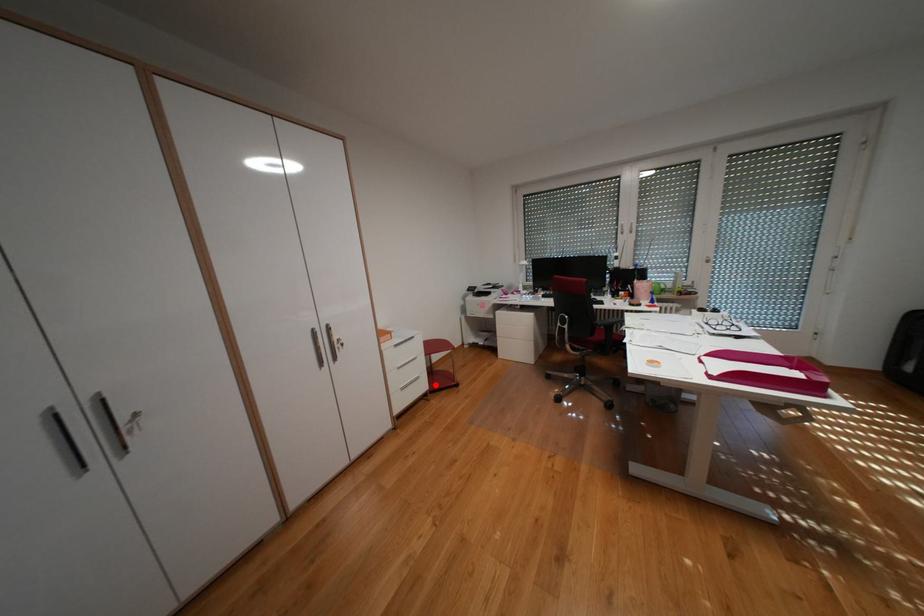
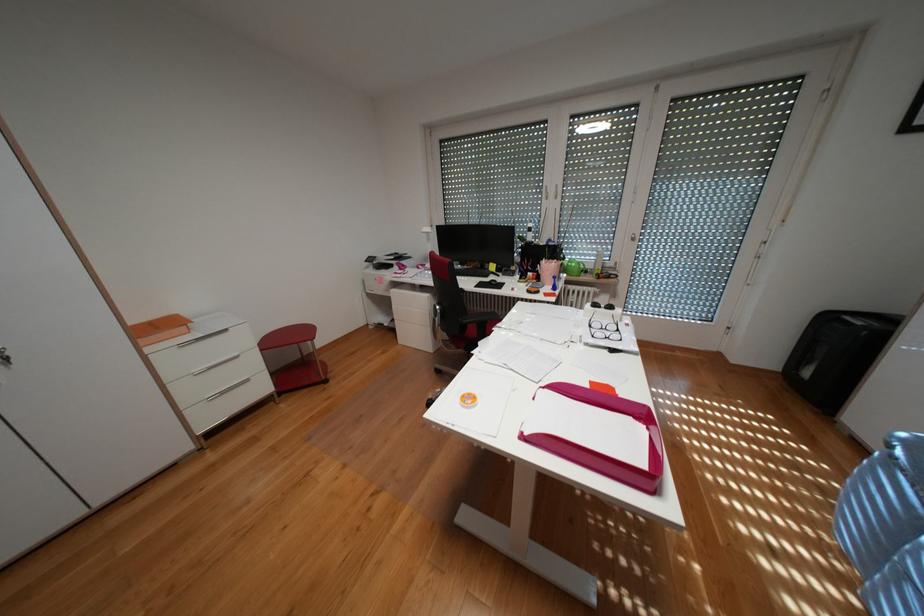
Find the pixel in the second image that matches the highlighted location in the first image.

(274, 387)